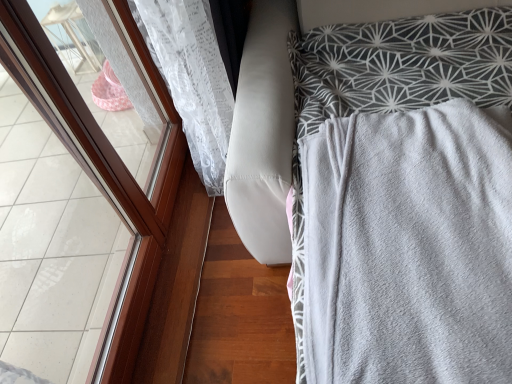
Question: From the image's perspective, is gray soft blanket at right positioned above or below brown wooden frame at left?

Choices:
 (A) below
 (B) above

Answer: (A)

Question: Is gray soft blanket at right in front of or behind brown wooden frame at left in the image?

Choices:
 (A) behind
 (B) front

Answer: (B)

Question: In terms of width, does gray soft blanket at right look wider or thinner when compared to brown wooden frame at left?

Choices:
 (A) thin
 (B) wide

Answer: (B)

Question: From a real-world perspective, is brown wooden frame at left physically located above or below gray soft blanket at right?

Choices:
 (A) above
 (B) below

Answer: (A)

Question: Relative to gray soft blanket at right, is brown wooden frame at left in front or behind?

Choices:
 (A) behind
 (B) front

Answer: (A)

Question: Which is correct: brown wooden frame at left is inside gray soft blanket at right, or outside of it?

Choices:
 (A) inside
 (B) outside

Answer: (B)

Question: In terms of size, does brown wooden frame at left appear bigger or smaller than gray soft blanket at right?

Choices:
 (A) small
 (B) big

Answer: (A)